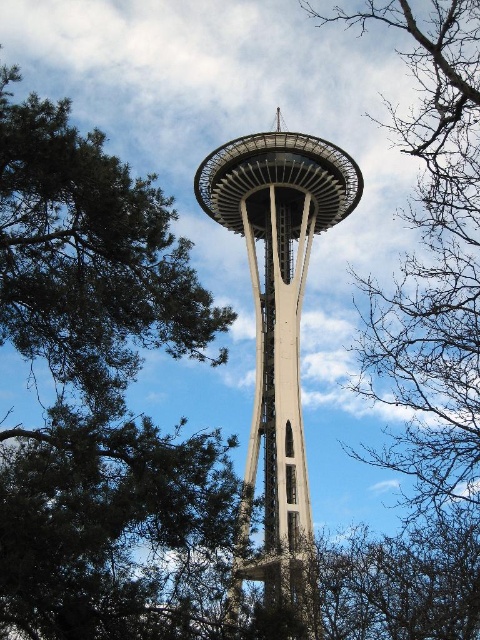
You are a photographer planning to capture the Space Needle against the sky. You notice the green leafy tree at upper left and the concrete tower at center in your shot. Which object appears wider in the frame?

The green leafy tree at upper left appears wider than the concrete tower at center in the frame.

You are standing in a park near the Space Needle and see the bare branches at center and the concrete tower at center. Which object is positioned to the right of the other?

The bare branches at center are to the right of the concrete tower at center.

From the picture: You are a photographer standing in a park with a view of the Space Needle. You notice the bare branches at center and the concrete tower at center in your camera frame. Which object is closer to you, the photographer?

A: The bare branches at center are closer to you because the concrete tower at center is positioned behind them.